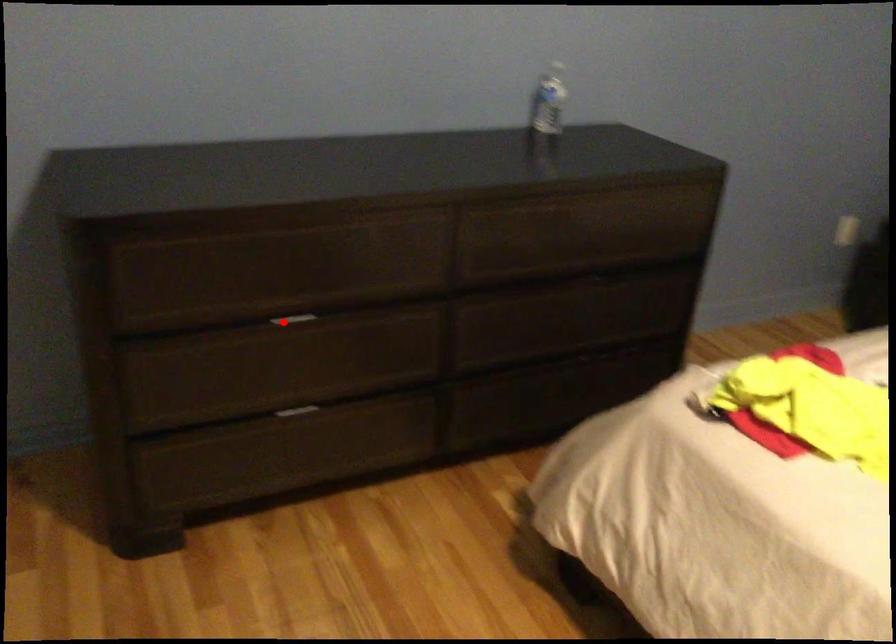
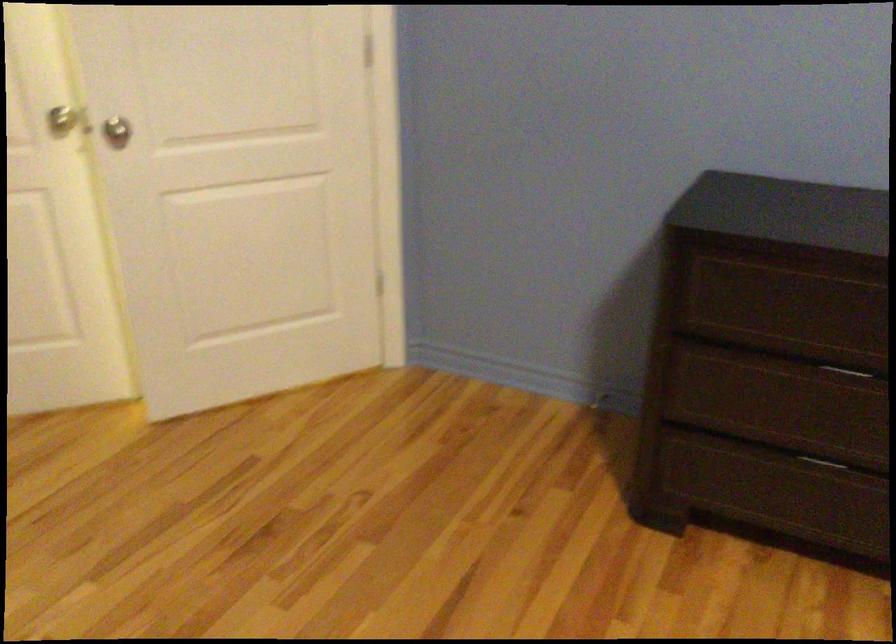
Locate, in the second image, the point that corresponds to the highlighted location in the first image.

(850, 371)